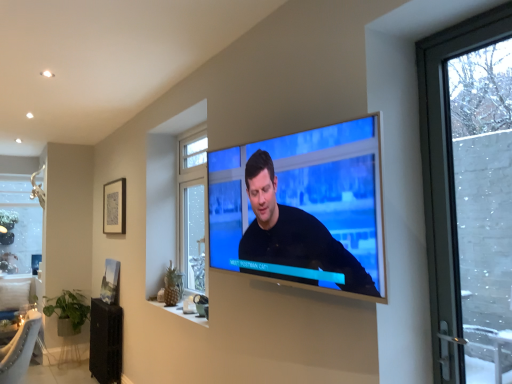
Question: From a real-world perspective, is matte black picture frame at upper left, which appears as the 2th picture frame when ordered from the bottom, positioned under matte black tv at center based on gravity?

Choices:
 (A) no
 (B) yes

Answer: (A)

Question: Is matte black picture frame at upper left, which appears as the 2th picture frame when ordered from the bottom, with matte black tv at center?

Choices:
 (A) yes
 (B) no

Answer: (B)

Question: Is matte black picture frame at upper left, which appears as the 2th picture frame when ordered from the bottom, thinner than matte black tv at center?

Choices:
 (A) yes
 (B) no

Answer: (A)

Question: Could you tell me if matte black picture frame at upper left, which is the 1th picture frame from top to bottom, is facing matte black tv at center?

Choices:
 (A) yes
 (B) no

Answer: (B)

Question: Is there a large distance between matte black picture frame at upper left, which appears as the 2th picture frame when ordered from the bottom, and matte black tv at center?

Choices:
 (A) no
 (B) yes

Answer: (B)

Question: Is point (285, 249) closer or farther from the camera than point (120, 208)?

Choices:
 (A) farther
 (B) closer

Answer: (B)

Question: Looking at the image, does matte black tv at center seem bigger or smaller compared to matte black picture frame at upper left, which appears as the 2th picture frame when ordered from the bottom?

Choices:
 (A) big
 (B) small

Answer: (A)

Question: In terms of height, does matte black tv at center look taller or shorter compared to matte black picture frame at upper left, which appears as the 2th picture frame when ordered from the bottom?

Choices:
 (A) tall
 (B) short

Answer: (A)

Question: Considering the relative positions of matte black tv at center and matte black picture frame at upper left, which is the 1th picture frame from top to bottom, in the image provided, is matte black tv at center to the left or to the right of matte black picture frame at upper left, which is the 1th picture frame from top to bottom,?

Choices:
 (A) left
 (B) right

Answer: (B)

Question: Is matte black picture frame at upper left, which is the 1th picture frame from top to bottom, spatially inside matte black tv at center, or outside of it?

Choices:
 (A) outside
 (B) inside

Answer: (A)

Question: Based on their positions, is matte black picture frame at upper left, which appears as the 2th picture frame when ordered from the bottom, located to the left or right of matte black tv at center?

Choices:
 (A) right
 (B) left

Answer: (B)

Question: Considering the positions of matte black picture frame at upper left, which is the 1th picture frame from top to bottom, and matte black tv at center in the image, is matte black picture frame at upper left, which is the 1th picture frame from top to bottom, bigger or smaller than matte black tv at center?

Choices:
 (A) big
 (B) small

Answer: (B)

Question: In terms of height, does matte black picture frame at upper left, which appears as the 2th picture frame when ordered from the bottom, look taller or shorter compared to matte black tv at center?

Choices:
 (A) short
 (B) tall

Answer: (A)

Question: From a real-world perspective, is matte black tv at center above or below clear glass window at upper left, which ranks as the 2th window in right-to-left order?

Choices:
 (A) below
 (B) above

Answer: (B)

Question: From their relative heights in the image, would you say matte black tv at center is taller or shorter than clear glass window at upper left, which appears as the first window when viewed from the left?

Choices:
 (A) tall
 (B) short

Answer: (B)